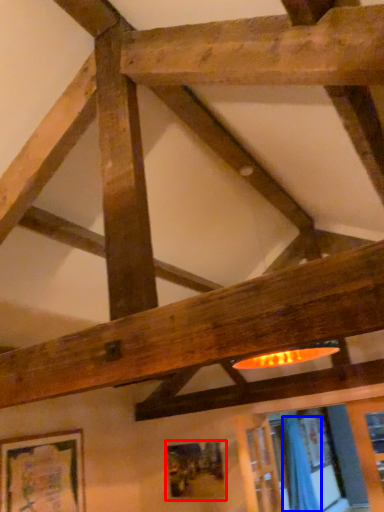
Question: Which object appears farthest to the camera in this image, picture frame (highlighted by a red box) or curtain (highlighted by a blue box)?

Choices:
 (A) picture frame
 (B) curtain

Answer: (B)